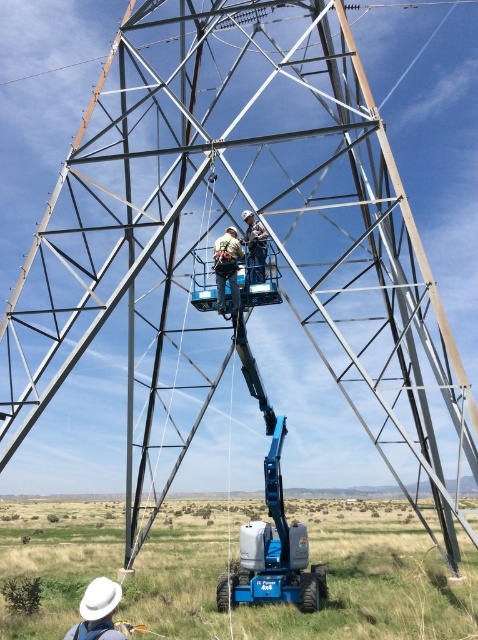
Between blue metallic boom lift at lower center and metallic safety harness at center, which one appears on the left side from the viewer's perspective?

Positioned to the left is metallic safety harness at center.

The height and width of the screenshot is (640, 478). Describe the element at coordinates (269, 524) in the screenshot. I see `blue metallic boom lift at lower center` at that location.

Between point (279, 426) and point (257, 253), which one is positioned behind?

The point (257, 253) is behind.

Find the location of a particular element. blue metallic boom lift at lower center is located at coordinates (269, 524).

Based on the photo, who is positioned more to the right, white fabric hat at lower left or light brown fabric safety harness at center?

From the viewer's perspective, light brown fabric safety harness at center appears more on the right side.

Who is more forward, (100, 637) or (229, 268)?

Point (100, 637)

Is point (119, 586) closer to viewer compared to point (235, 294)?

Yes, point (119, 586) is closer to viewer.

You are a GUI agent. You are given a task and a screenshot of the screen. Output one action in this format:
    pyautogui.click(x=<x>, y=<y>)
    Task: Click on the white fabric hat at lower left
    The image size is (478, 640).
    Given the screenshot: What is the action you would take?
    pyautogui.click(x=97, y=611)

Is blue metallic boom lift at lower center to the left of white fabric hat at lower left from the viewer's perspective?

Incorrect, blue metallic boom lift at lower center is not on the left side of white fabric hat at lower left.

Is blue metallic boom lift at lower center positioned in front of white fabric hat at lower left?

No.

Who is more distant from viewer, [263,573] or [73,628]?

Positioned behind is point [263,573].

Where is `blue metallic boom lift at lower center`? The width and height of the screenshot is (478, 640). blue metallic boom lift at lower center is located at coordinates (269, 524).